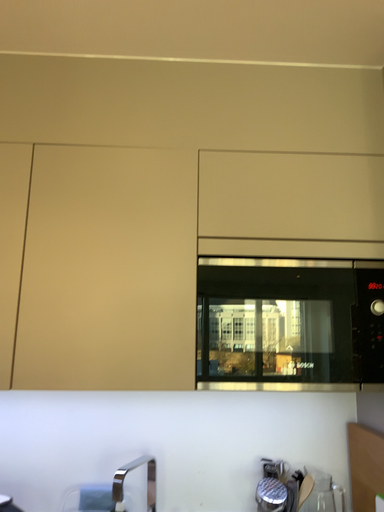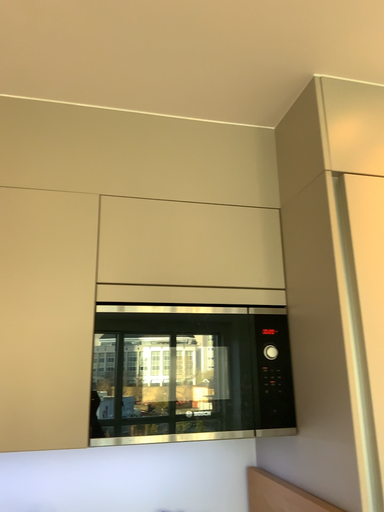
Question: Which way did the camera rotate in the video?

Choices:
 (A) rotated right
 (B) rotated left

Answer: (A)